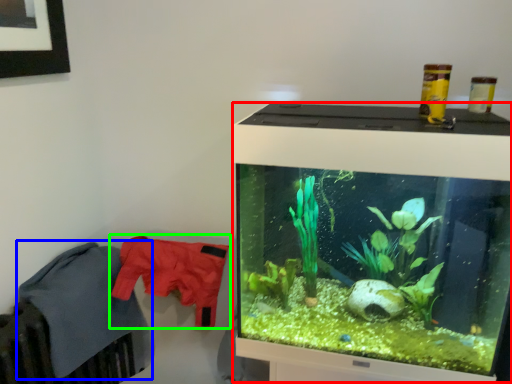
Question: Which object is positioned closest to computer monitor (highlighted by a red box)? Select from clothing (highlighted by a blue box) and clothing (highlighted by a green box).

Choices:
 (A) clothing
 (B) clothing

Answer: (B)